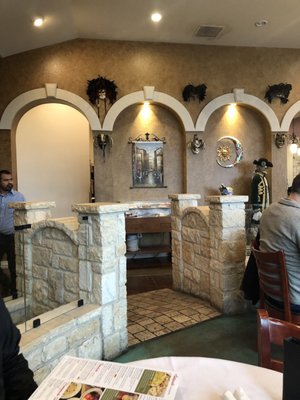
Where is `brown chair`? brown chair is located at coordinates (261, 328), (277, 276).